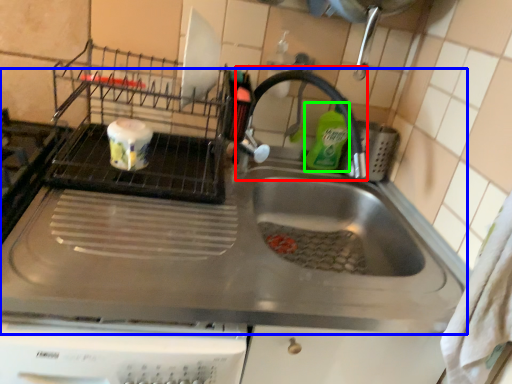
Question: Based on their relative distances, which object is farther from faucet (highlighted by a red box)? Choose from sink (highlighted by a blue box) and cleaning product (highlighted by a green box).

Choices:
 (A) sink
 (B) cleaning product

Answer: (A)